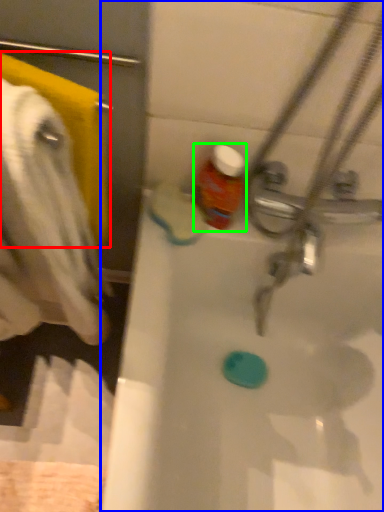
Question: Which object is positioned farthest from towel/napkin (highlighted by a red box)? Select from bathtub (highlighted by a blue box) and bottle (highlighted by a green box).

Choices:
 (A) bathtub
 (B) bottle

Answer: (A)